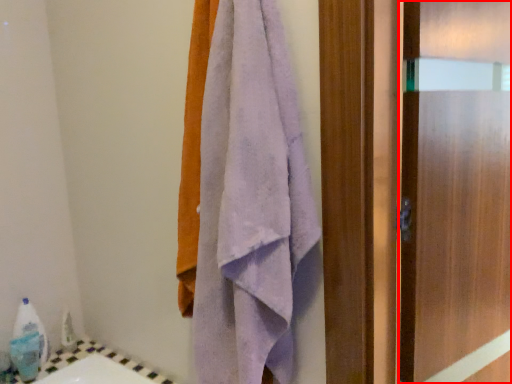
Question: From the image's perspective, where is screen door (annotated by the red box) located in relation to towel in the image?

Choices:
 (A) above
 (B) below

Answer: (B)